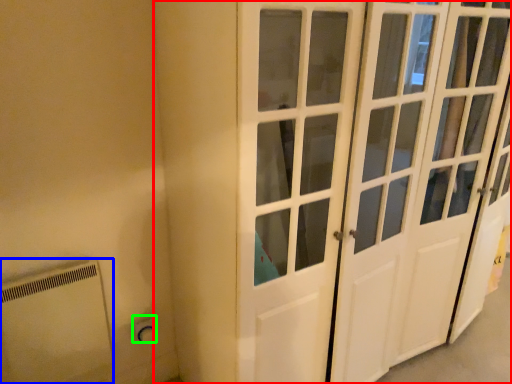
Question: Which object is the farthest from door (highlighted by a red box)? Choose among these: appliance (highlighted by a blue box) or electric outlet (highlighted by a green box).

Choices:
 (A) appliance
 (B) electric outlet

Answer: (B)